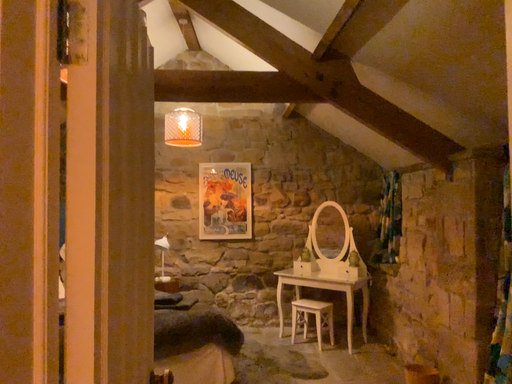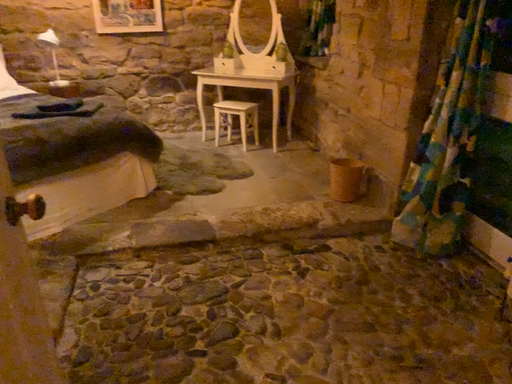
Question: How did the camera likely rotate when shooting the video?

Choices:
 (A) rotated downward
 (B) rotated upward

Answer: (A)